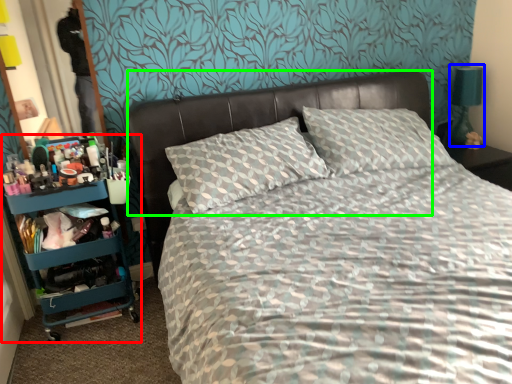
Question: Considering the real-world distances, which object is farthest from bookshelf (highlighted by a red box)? bedside lamp (highlighted by a blue box) or headboard (highlighted by a green box)?

Choices:
 (A) bedside lamp
 (B) headboard

Answer: (A)